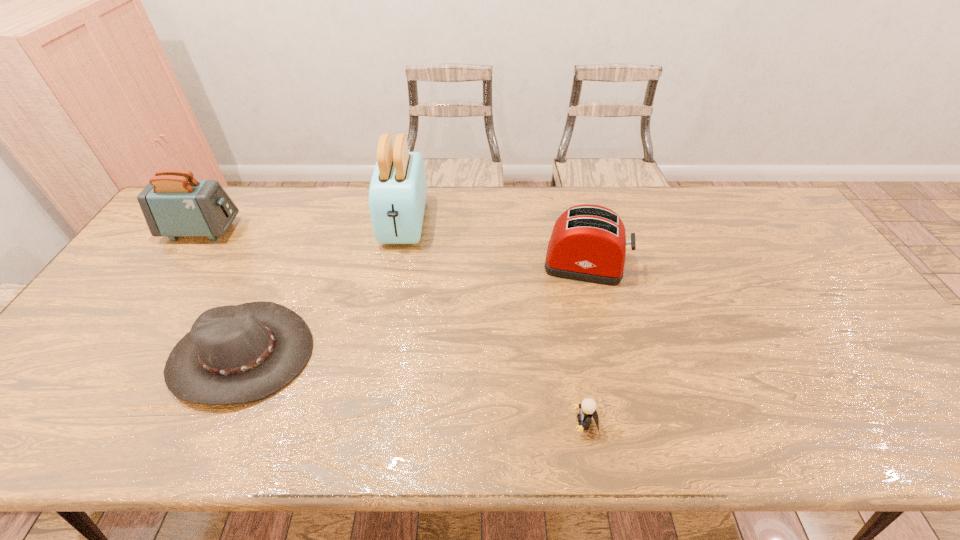
Find the location of a particular element. The height and width of the screenshot is (540, 960). free spot at the far edge of the desktop is located at coordinates (516, 185).

Locate an element on the screen. The width and height of the screenshot is (960, 540). vacant region at the near edge is located at coordinates (815, 421).

In the image, there is a desktop. Where is `free space at the far right corner`? This screenshot has width=960, height=540. free space at the far right corner is located at coordinates (756, 211).

Image resolution: width=960 pixels, height=540 pixels. Identify the location of vacant space in between the shortest object and the second object from left to right. (414, 389).

The height and width of the screenshot is (540, 960). What are the coordinates of `unoccupied position between the Lego and the shortest toaster` in the screenshot? It's located at (585, 343).

Locate an element on the screen. This screenshot has width=960, height=540. vacant space in between the hat and the leftmost toaster is located at coordinates (222, 292).

I want to click on vacant space that's between the third object from left to right and the Lego, so click(x=494, y=322).

You are a GUI agent. You are given a task and a screenshot of the screen. Output one action in this format:
    pyautogui.click(x=<x>, y=<y>)
    Task: Click on the vacant space in between the tallest object and the second shortest object
    This screenshot has width=960, height=540.
    Given the screenshot: What is the action you would take?
    pyautogui.click(x=323, y=288)

You are a GUI agent. You are given a task and a screenshot of the screen. Output one action in this format:
    pyautogui.click(x=<x>, y=<y>)
    Task: Click on the vacant space in between the hat and the leftmost object
    
    Given the screenshot: What is the action you would take?
    pyautogui.click(x=222, y=292)

Locate an element on the screen. This screenshot has height=540, width=960. unoccupied position between the fourth tallest object and the fourth shortest object is located at coordinates (222, 292).